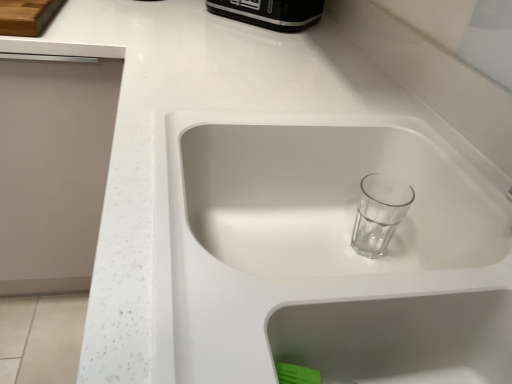
This screenshot has width=512, height=384. Describe the element at coordinates (270, 13) in the screenshot. I see `black plastic toaster at upper center` at that location.

This screenshot has height=384, width=512. I want to click on black plastic toaster at upper center, so click(x=270, y=13).

What are the coordinates of `black plastic toaster at upper center` in the screenshot? It's located at (270, 13).